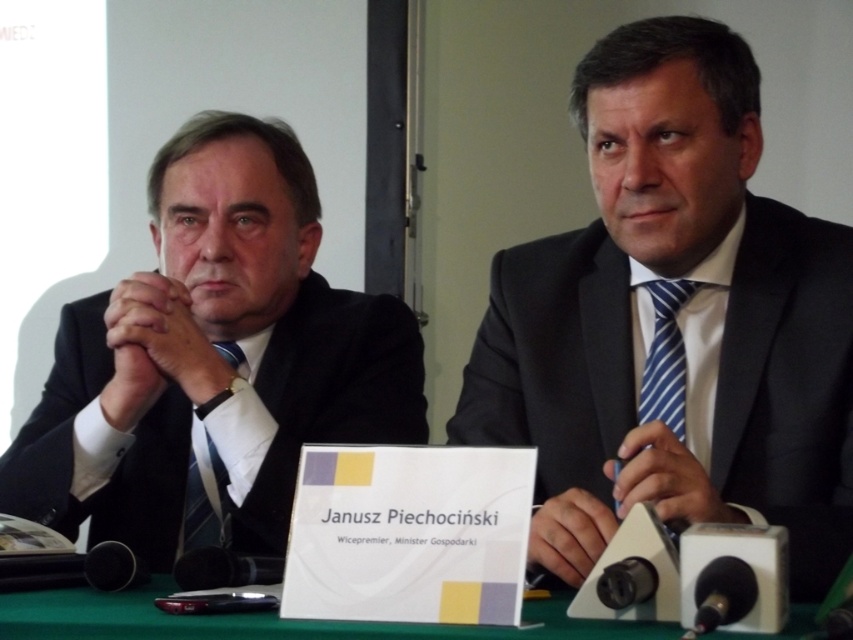
Does matte black suit at right have a larger size compared to green fabric table at center?

Yes, matte black suit at right is bigger than green fabric table at center.

Between matte black suit at right and green fabric table at center, which one has less height?

With less height is green fabric table at center.

Find the location of a particular element. The width and height of the screenshot is (853, 640). matte black suit at right is located at coordinates (672, 321).

This screenshot has width=853, height=640. What do you see at coordinates (665, 358) in the screenshot?
I see `blue striped tie at right` at bounding box center [665, 358].

Is blue striped tie at right thinner than matte black tie at center?

No.

The image size is (853, 640). I want to click on blue striped tie at right, so click(665, 358).

Is black suit at left smaller than matte black tie at center?

No, black suit at left is not smaller than matte black tie at center.

Does point (318, 422) come in front of point (183, 547)?

No, it is not.

You are a GUI agent. You are given a task and a screenshot of the screen. Output one action in this format:
    pyautogui.click(x=<x>, y=<y>)
    Task: Click on the black suit at left
    
    Given the screenshot: What is the action you would take?
    pyautogui.click(x=212, y=362)